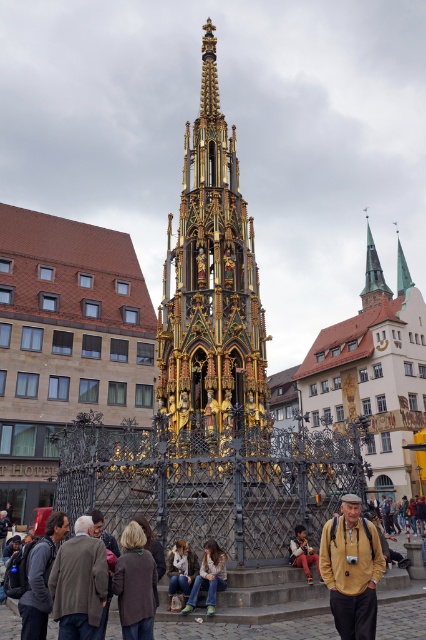
Between point (34, 557) and point (187, 588), which one is positioned in front?

Point (34, 557)

What do you see at coordinates (40, 579) in the screenshot? Image resolution: width=426 pixels, height=640 pixels. I see `dark brown leather jacket at lower left` at bounding box center [40, 579].

Where is `dark brown leather jacket at lower left`? Image resolution: width=426 pixels, height=640 pixels. dark brown leather jacket at lower left is located at coordinates (40, 579).

Does blonde hair at center appear over green copper spire at upper right?

No, blonde hair at center is not above green copper spire at upper right.

The height and width of the screenshot is (640, 426). Find the location of `blonde hair at center`. blonde hair at center is located at coordinates (135, 584).

Which is in front, point (155, 602) or point (403, 268)?

Point (155, 602) is in front.

Identify the location of blonde hair at center. (135, 584).

Is brown leather jacket at lower left closer to camera compared to leather jacket at lower right?

Yes, it is.

I want to click on brown leather jacket at lower left, so click(106, 563).

Is point (100, 534) positioned behind point (298, 528)?

No, (100, 534) is in front of (298, 528).

At what (x,y) coordinates should I click in order to perform the action: click on brown leather jacket at lower left. Please return your answer as a coordinate pair (x, y). Looking at the image, I should click on (106, 563).